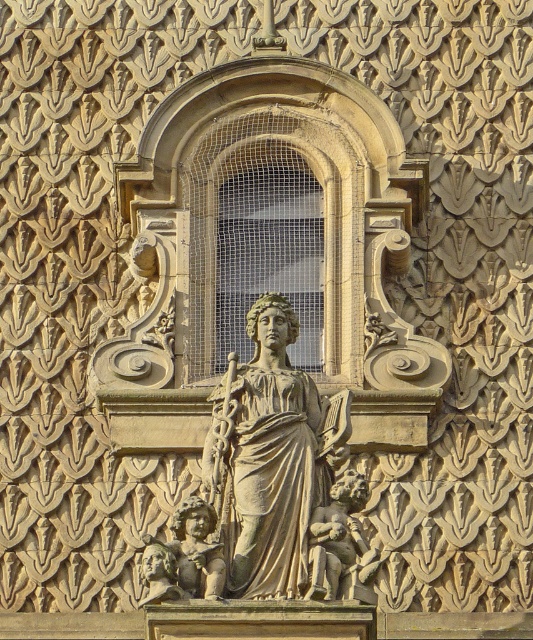
Question: Is beige stone statue at center smaller than smooth stone cherub at center?

Choices:
 (A) yes
 (B) no

Answer: (B)

Question: Is beige stone statue at center above smooth stone cherub at center?

Choices:
 (A) yes
 (B) no

Answer: (A)

Question: Which object appears closest to the camera in this image?

Choices:
 (A) smooth stone cherub at center
 (B) beige stone statue at center

Answer: (A)

Question: Where is beige stone statue at center located in relation to smooth stone cherub at center in the image?

Choices:
 (A) left
 (B) right

Answer: (A)

Question: Which point is closer to the camera taking this photo?

Choices:
 (A) (285, 348)
 (B) (338, 593)

Answer: (B)